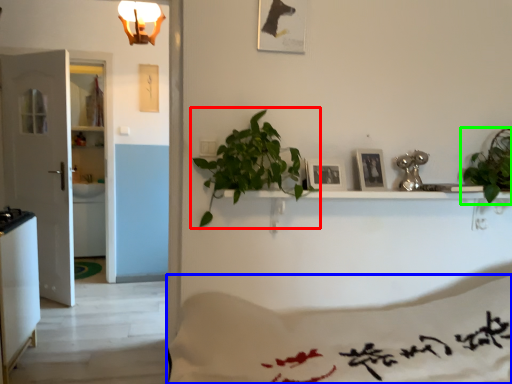
Question: Based on their relative distances, which object is farther from houseplant (highlighted by a red box)? Choose from sheet (highlighted by a blue box) and houseplant (highlighted by a green box).

Choices:
 (A) sheet
 (B) houseplant

Answer: (B)